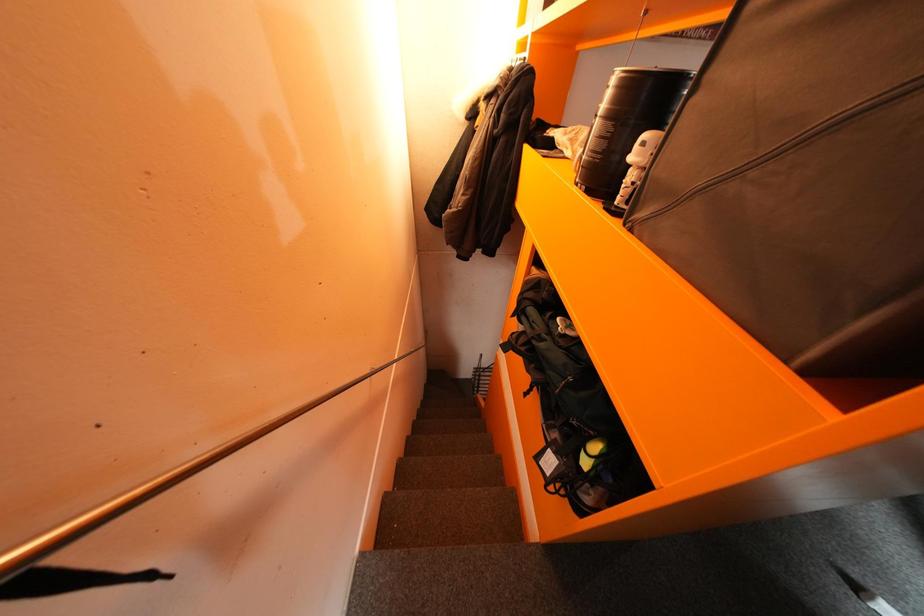
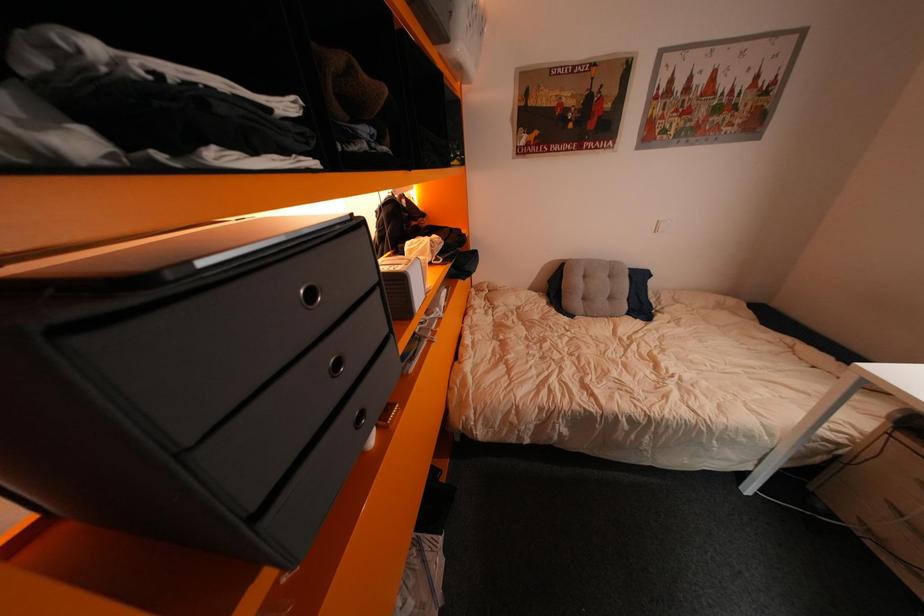
Question: What movement of the cameraman would produce the second image?

Choices:
 (A) Left
 (B) Right
 (C) Forward
 (D) Backward

Answer: (B)